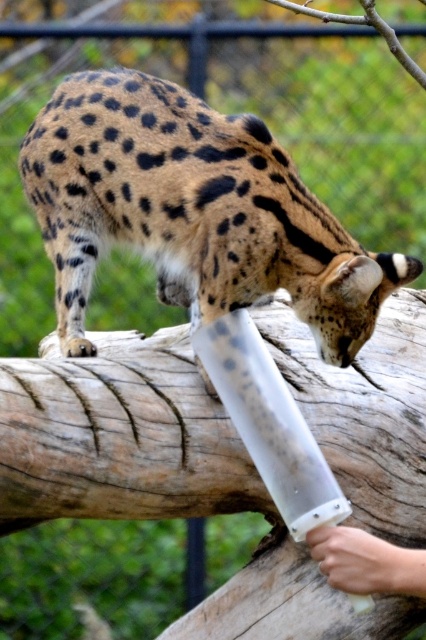
You are a zookeeper observing a serval drinking from a tube held by a person. Based on the image, can you determine if the spotted fur cheetah at upper center is positioned to the left or right of the smooth skin hand at lower right?

The spotted fur cheetah at upper center is to the left of the smooth skin hand at lower right according to the description.

You are a zookeeper observing a serval drinking from a plastic tube. You notice a point marked at coordinates (x=192, y=211). Which animal does this point belong to?

The point at (x=192, y=211) is on the spotted fur cheetah at upper center.

You are standing in front of the serval and want to place a treat between the two points, point (241, 154) and point (376, 547). Which point is closer to you so you can reach it first?

Point (241, 154) is closer to you than point (376, 547), so you can reach it first.